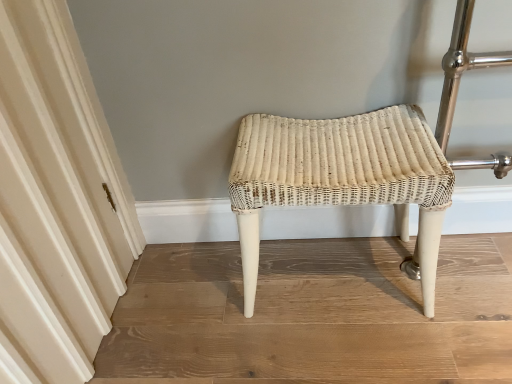
The height and width of the screenshot is (384, 512). Find the location of `creamy white fabric at left`. creamy white fabric at left is located at coordinates (56, 202).

Describe the element at coordinates (56, 202) in the screenshot. I see `creamy white fabric at left` at that location.

Measure the distance between point (61, 325) and camera.

The distance of point (61, 325) from camera is 36.73 inches.

What do you see at coordinates (342, 177) in the screenshot? I see `white wicker stool at center` at bounding box center [342, 177].

Locate an element on the screen. Image resolution: width=512 pixels, height=384 pixels. white wicker stool at center is located at coordinates (342, 177).

Where is `creamy white fabric at left`? The height and width of the screenshot is (384, 512). creamy white fabric at left is located at coordinates (56, 202).

From the picture: Is white wicker stool at center to the right of creamy white fabric at left from the viewer's perspective?

Yes.

Is the position of white wicker stool at center more distant than that of creamy white fabric at left?

Yes, it is behind creamy white fabric at left.

Which is closer to the camera, (275, 125) or (76, 187)?

The point (76, 187) is closer to the camera.

From the image's perspective, who appears lower, white wicker stool at center or creamy white fabric at left?

white wicker stool at center is shown below in the image.

From a real-world perspective, does white wicker stool at center stand above creamy white fabric at left?

Incorrect, from a real-world perspective, white wicker stool at center is lower than creamy white fabric at left.

In terms of width, does white wicker stool at center look wider or thinner when compared to creamy white fabric at left?

Considering their sizes, white wicker stool at center looks broader than creamy white fabric at left.

From their relative heights in the image, would you say white wicker stool at center is taller or shorter than creamy white fabric at left?

Clearly, white wicker stool at center is shorter compared to creamy white fabric at left.

Considering the sizes of objects white wicker stool at center and creamy white fabric at left in the image provided, who is smaller, white wicker stool at center or creamy white fabric at left?

creamy white fabric at left is smaller.

Would you say white wicker stool at center contains creamy white fabric at left?

No.

Does white wicker stool at center touch creamy white fabric at left?

They are not placed beside each other.

Is white wicker stool at center positioned with its back to creamy white fabric at left?

No, creamy white fabric at left is not at the back of white wicker stool at center.

Identify the location of stool below the creamy white fabric at left (from the image's perspective). (342, 177).

Considering the relative positions of creamy white fabric at left and white wicker stool at center in the image provided, is creamy white fabric at left to the left of white wicker stool at center from the viewer's perspective?

Yes, creamy white fabric at left is to the left of white wicker stool at center.

Which object is closer to the camera taking this photo, creamy white fabric at left or white wicker stool at center?

Positioned in front is creamy white fabric at left.

Considering the points (24, 302) and (328, 125), which point is in front, point (24, 302) or point (328, 125)?

Positioned in front is point (24, 302).

From the image's perspective, which one is positioned lower, creamy white fabric at left or white wicker stool at center?

white wicker stool at center.

From a real-world perspective, is creamy white fabric at left physically located above or below white wicker stool at center?

creamy white fabric at left is situated higher than white wicker stool at center in the real world.

Which object is thinner, creamy white fabric at left or white wicker stool at center?

creamy white fabric at left is thinner.

Does creamy white fabric at left have a lesser height compared to white wicker stool at center?

In fact, creamy white fabric at left may be taller than white wicker stool at center.

Which of these two, creamy white fabric at left or white wicker stool at center, is bigger?

With larger size is white wicker stool at center.

Is white wicker stool at center a part of creamy white fabric at left?

No, white wicker stool at center is not surrounded by creamy white fabric at left.

Is creamy white fabric at left not close to white wicker stool at center?

That's not correct — creamy white fabric at left is a little close to white wicker stool at center.

Is creamy white fabric at left turned away from white wicker stool at center?

No, white wicker stool at center is not at the back of creamy white fabric at left.

How many degrees apart are the facing directions of creamy white fabric at left and white wicker stool at center?

90.1 degrees.

I want to click on stool on the right of creamy white fabric at left, so click(x=342, y=177).

You are a GUI agent. You are given a task and a screenshot of the screen. Output one action in this format:
    pyautogui.click(x=<x>, y=<y>)
    Task: Click on the stool directly beneath the creamy white fabric at left (from a real-world perspective)
    The image size is (512, 384).
    Given the screenshot: What is the action you would take?
    pyautogui.click(x=342, y=177)

This screenshot has width=512, height=384. I want to click on stool behind the creamy white fabric at left, so click(342, 177).